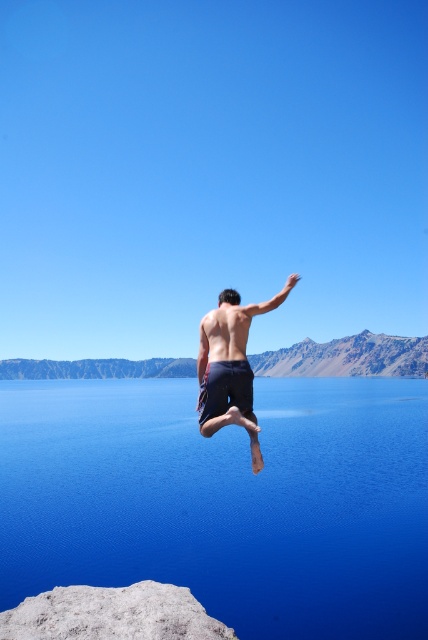
Question: Observing the image, what is the correct spatial positioning of gray rough rock at lower left in reference to muscular tan skin at center?

Choices:
 (A) below
 (B) above

Answer: (A)

Question: Is blue smooth water at center to the right of dark blue shorts at center from the viewer's perspective?

Choices:
 (A) no
 (B) yes

Answer: (A)

Question: Which point appears closest to the camera in this image?

Choices:
 (A) (199, 604)
 (B) (201, 387)
 (C) (115, 420)
 (D) (241, 320)

Answer: (A)

Question: Which of these objects is positioned closest to the gray rough rock at lower left?

Choices:
 (A) muscular tan skin at center
 (B) blue smooth water at center

Answer: (A)

Question: In this image, where is blue smooth water at center located relative to gray rough rock at lower left?

Choices:
 (A) left
 (B) right

Answer: (A)

Question: Which point is closer to the camera taking this photo?

Choices:
 (A) (109, 598)
 (B) (244, 356)
 (C) (288, 278)
 (D) (91, 451)

Answer: (A)